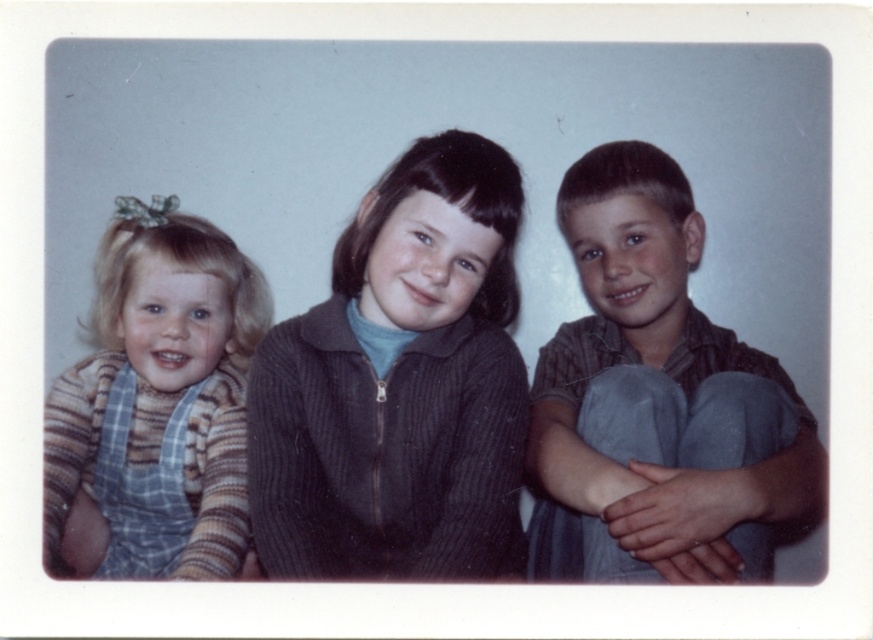
Does matte brown shirt at right have a greater height compared to striped knit sweater at left?

Indeed, matte brown shirt at right has a greater height compared to striped knit sweater at left.

Does matte brown shirt at right have a larger size compared to striped knit sweater at left?

Yes, matte brown shirt at right is bigger than striped knit sweater at left.

Is point (658, 384) positioned in front of point (190, 403)?

Yes, it is.

I want to click on matte brown shirt at right, so click(x=663, y=392).

Is dark ribbed sweater at center thinner than striped knit sweater at left?

No, dark ribbed sweater at center is not thinner than striped knit sweater at left.

In the scene shown: Who is higher up, dark ribbed sweater at center or striped knit sweater at left?

dark ribbed sweater at center is above.

The height and width of the screenshot is (640, 873). What do you see at coordinates (400, 387) in the screenshot?
I see `dark ribbed sweater at center` at bounding box center [400, 387].

Locate an element on the screen. dark ribbed sweater at center is located at coordinates (400, 387).

Is dark ribbed sweater at center wider than matte brown shirt at right?

No.

Which is behind, point (330, 356) or point (758, 529)?

The point (330, 356) is behind.

Find the location of a particular element. The height and width of the screenshot is (640, 873). dark ribbed sweater at center is located at coordinates (400, 387).